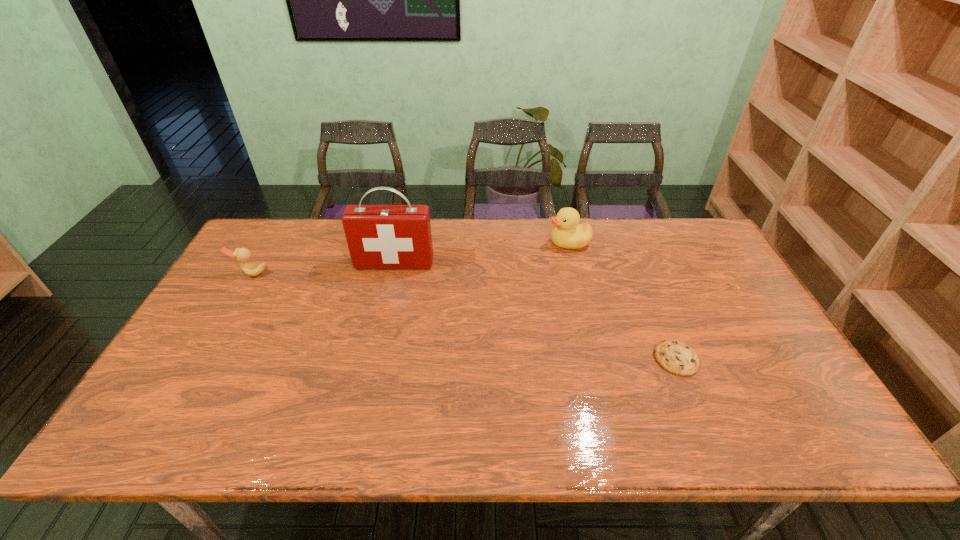
Locate an element on the screen. object that is the second closest to the shorter duck is located at coordinates (568, 233).

At what (x,y) coordinates should I click in order to perform the action: click on the closest object to the tallest object. Please return your answer as a coordinate pair (x, y). Looking at the image, I should click on (241, 255).

The width and height of the screenshot is (960, 540). Identify the location of vacant space that satisfies the following two spatial constraints: 1. on the beak of the nearest object; 2. on the right side of the left duck. (202, 359).

What are the coordinates of `vacant area in the image that satisfies the following two spatial constraints: 1. on the beak of the rightmost object; 2. on the right side of the leftmost object` in the screenshot? It's located at coord(202,359).

Find the location of a particular element. vacant area in the image that satisfies the following two spatial constraints: 1. on the back side of the rightmost object; 2. at the beak of the farthest object is located at coordinates (629, 242).

Where is `free spot that satisfies the following two spatial constraints: 1. on the beak of the shortest object; 2. on the right side of the nearer duck`? free spot that satisfies the following two spatial constraints: 1. on the beak of the shortest object; 2. on the right side of the nearer duck is located at coordinates [202, 359].

I want to click on vacant position in the image that satisfies the following two spatial constraints: 1. on the beak of the shortest object; 2. on the left side of the shorter duck, so click(202, 359).

Find the location of a particular element. This screenshot has height=540, width=960. vacant space that satisfies the following two spatial constraints: 1. at the beak of the second tallest object; 2. on the beak of the second shortest object is located at coordinates (576, 274).

This screenshot has height=540, width=960. Find the location of `free space that satisfies the following two spatial constraints: 1. on the front face of the first-aid kit; 2. on the left side of the cookie`. free space that satisfies the following two spatial constraints: 1. on the front face of the first-aid kit; 2. on the left side of the cookie is located at coordinates (x=372, y=359).

You are a GUI agent. You are given a task and a screenshot of the screen. Output one action in this format:
    pyautogui.click(x=<x>, y=<y>)
    Task: Click on the vacant area in the image that satisfies the following two spatial constraints: 1. on the front face of the shortest object; 2. on the right side of the second object from left to right
    
    Given the screenshot: What is the action you would take?
    pyautogui.click(x=372, y=359)